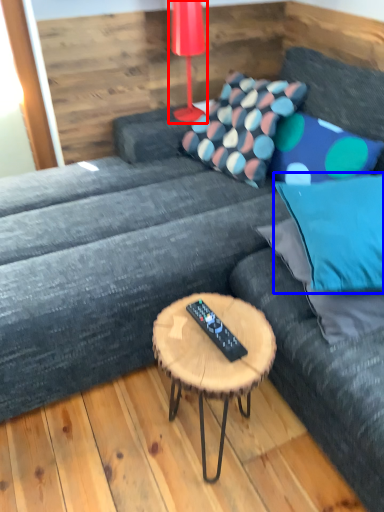
Question: Which object appears closest to the camera in this image, table lamp (highlighted by a red box) or pillow (highlighted by a blue box)?

Choices:
 (A) table lamp
 (B) pillow

Answer: (B)